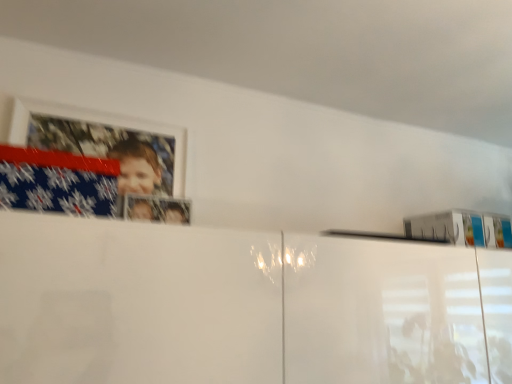
This screenshot has height=384, width=512. I want to click on blue fabric flag at upper left, so click(x=57, y=182).

Image resolution: width=512 pixels, height=384 pixels. What do you see at coordinates (57, 182) in the screenshot?
I see `blue fabric flag at upper left` at bounding box center [57, 182].

You are a GUI agent. You are given a task and a screenshot of the screen. Output one action in this format:
    pyautogui.click(x=<x>, y=<y>)
    Task: Click on the white glossy picture frame at upper left
    This screenshot has height=384, width=512.
    Given the screenshot: What is the action you would take?
    pyautogui.click(x=89, y=165)

Measure the distance between point [59,111] and camera.

The depth of point [59,111] is 1.15 meters.

The height and width of the screenshot is (384, 512). Describe the element at coordinates (89, 165) in the screenshot. I see `white glossy picture frame at upper left` at that location.

Where is `blue fabric flag at upper left`? Image resolution: width=512 pixels, height=384 pixels. blue fabric flag at upper left is located at coordinates (57, 182).

Would you say blue fabric flag at upper left is to the left or to the right of white glossy picture frame at upper left in the picture?

Clearly, blue fabric flag at upper left is on the left of white glossy picture frame at upper left in the image.

Is the position of blue fabric flag at upper left more distant than that of white glossy picture frame at upper left?

No, it is not.

Which is in front, point (48, 154) or point (180, 216)?

The point (48, 154) is in front.

From the image's perspective, who appears lower, blue fabric flag at upper left or white glossy picture frame at upper left?

blue fabric flag at upper left is shown below in the image.

From a real-world perspective, is blue fabric flag at upper left positioned above or below white glossy picture frame at upper left?

In terms of real-world spatial position, blue fabric flag at upper left is below white glossy picture frame at upper left.

Is blue fabric flag at upper left thinner than white glossy picture frame at upper left?

No, blue fabric flag at upper left is not thinner than white glossy picture frame at upper left.

In terms of height, does blue fabric flag at upper left look taller or shorter compared to white glossy picture frame at upper left?

Considering their sizes, blue fabric flag at upper left has less height than white glossy picture frame at upper left.

Which of these two, blue fabric flag at upper left or white glossy picture frame at upper left, is smaller?

With smaller size is white glossy picture frame at upper left.

Is blue fabric flag at upper left inside the boundaries of white glossy picture frame at upper left, or outside?

blue fabric flag at upper left cannot be found inside white glossy picture frame at upper left.

Is blue fabric flag at upper left directly adjacent to white glossy picture frame at upper left?

No, blue fabric flag at upper left is not next to white glossy picture frame at upper left.

Could you tell me if blue fabric flag at upper left is turned towards white glossy picture frame at upper left?

No, blue fabric flag at upper left is not aimed at white glossy picture frame at upper left.

Measure the distance between blue fabric flag at upper left and white glossy picture frame at upper left.

→ blue fabric flag at upper left is 13.85 inches from white glossy picture frame at upper left.

You are a GUI agent. You are given a task and a screenshot of the screen. Output one action in this format:
    pyautogui.click(x=<x>, y=<y>)
    Task: Click on the picture frame on the right side of blue fabric flag at upper left
    
    Given the screenshot: What is the action you would take?
    pyautogui.click(x=89, y=165)

Considering the relative positions of white glossy picture frame at upper left and blue fabric flag at upper left in the image provided, is white glossy picture frame at upper left to the right of blue fabric flag at upper left from the viewer's perspective?

Yes.

Considering their positions, is white glossy picture frame at upper left located in front of or behind blue fabric flag at upper left?

In the image, white glossy picture frame at upper left appears behind blue fabric flag at upper left.

Does point (94, 178) come farther from viewer compared to point (27, 159)?

Yes, it is.

Based on the photo, from the image's perspective, would you say white glossy picture frame at upper left is shown under blue fabric flag at upper left?

No, from the image's perspective, white glossy picture frame at upper left is not beneath blue fabric flag at upper left.

Looking at this image, from a real-world perspective, does white glossy picture frame at upper left sit lower than blue fabric flag at upper left?

Actually, white glossy picture frame at upper left is physically above blue fabric flag at upper left in the real world.

Is white glossy picture frame at upper left thinner than blue fabric flag at upper left?

Yes.

Can you confirm if white glossy picture frame at upper left is shorter than blue fabric flag at upper left?

No.

Considering the relative sizes of white glossy picture frame at upper left and blue fabric flag at upper left in the image provided, is white glossy picture frame at upper left bigger than blue fabric flag at upper left?

Actually, white glossy picture frame at upper left might be smaller than blue fabric flag at upper left.

Choose the correct answer: Is white glossy picture frame at upper left inside blue fabric flag at upper left or outside it?

A: white glossy picture frame at upper left exists outside the volume of blue fabric flag at upper left.

Is white glossy picture frame at upper left far from blue fabric flag at upper left?

Actually, white glossy picture frame at upper left and blue fabric flag at upper left are a little close together.

Could you tell me if white glossy picture frame at upper left is facing blue fabric flag at upper left?

No, white glossy picture frame at upper left is not turned towards blue fabric flag at upper left.

How many degrees apart are the facing directions of white glossy picture frame at upper left and blue fabric flag at upper left?

0.000146 degrees separate the facing orientations of white glossy picture frame at upper left and blue fabric flag at upper left.

Looking at this image, measure the distance between white glossy picture frame at upper left and blue fabric flag at upper left.

They are 13.85 inches apart.

Identify the location of picture frame above the blue fabric flag at upper left (from a real-world perspective). pyautogui.click(x=89, y=165).

In the image, there is a white glossy picture frame at upper left. Where is `flag below it (from the image's perspective)`? flag below it (from the image's perspective) is located at coordinates (57, 182).

Locate an element on the screen. flag below the white glossy picture frame at upper left (from a real-world perspective) is located at coordinates (57, 182).